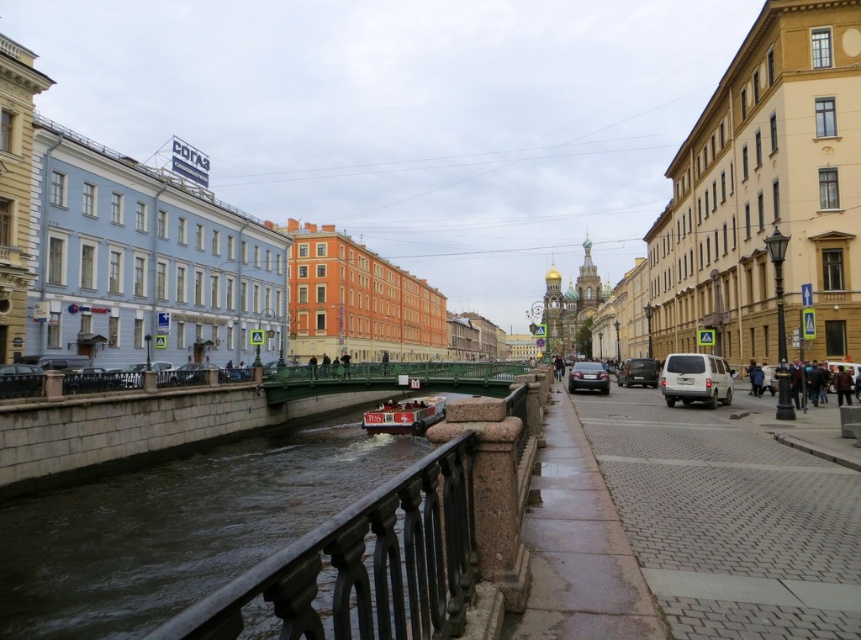
Is black polished metal railing at center smaller than metallic red boat at center?

Incorrect, black polished metal railing at center is not smaller in size than metallic red boat at center.

Image resolution: width=861 pixels, height=640 pixels. What do you see at coordinates (361, 566) in the screenshot?
I see `black polished metal railing at center` at bounding box center [361, 566].

Locate an element on the screen. black polished metal railing at center is located at coordinates (361, 566).

Which is more to the left, white matte van at center or dark brown leather jacket at lower right?

Positioned to the left is white matte van at center.

Can you confirm if white matte van at center is taller than dark brown leather jacket at lower right?

Yes, white matte van at center is taller than dark brown leather jacket at lower right.

Find the location of a particular element. Image resolution: width=861 pixels, height=640 pixels. white matte van at center is located at coordinates (695, 380).

Find the location of a particular element. white matte van at center is located at coordinates (695, 380).

How much distance is there between metallic red boat at center and satin black car at center?

metallic red boat at center and satin black car at center are 83.85 feet apart.

Is point (412, 419) farther from camera compared to point (583, 387)?

Yes, it is.

Between point (393, 417) and point (568, 381), which one is positioned behind?

The point (393, 417) is behind.

Identify the location of metallic red boat at center. Image resolution: width=861 pixels, height=640 pixels. (403, 416).